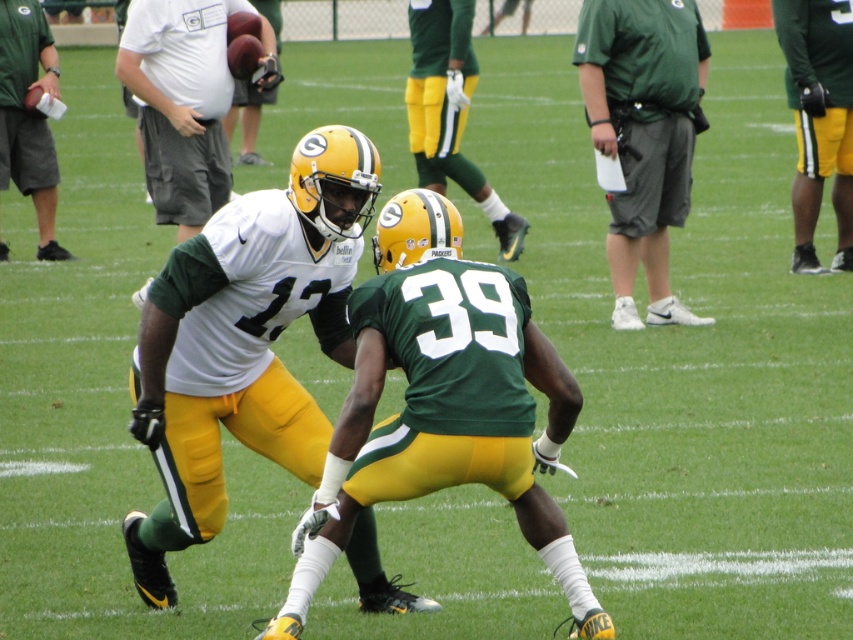
Question: Can you confirm if white jersey at center is thinner than green matte helmet at center?

Choices:
 (A) no
 (B) yes

Answer: (A)

Question: Which point is farther to the camera?

Choices:
 (A) (271, 99)
 (B) (822, 163)

Answer: (A)

Question: Where is matte white jersey at center located in relation to matte black football at upper left in the image?

Choices:
 (A) below
 (B) above

Answer: (A)

Question: Which object is farther from the camera taking this photo?

Choices:
 (A) green matte jersey at center
 (B) white jersey at center

Answer: (B)

Question: Which object appears farthest from the camera in this image?

Choices:
 (A) matte white jersey at center
 (B) green matte jersey at center

Answer: (A)

Question: Is matte white jersey at center further to the viewer compared to green matte jersey at center?

Choices:
 (A) yes
 (B) no

Answer: (A)